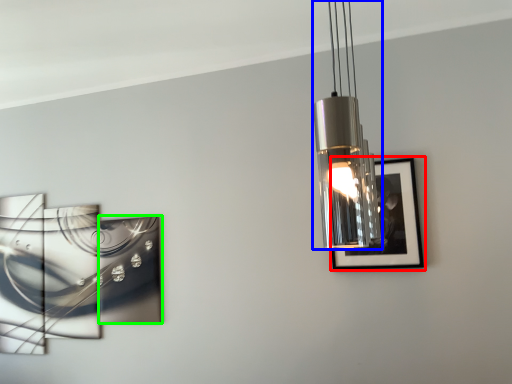
Question: Considering the real-world distances, which object is farthest from picture frame (highlighted by a red box)? lamp (highlighted by a blue box) or picture frame (highlighted by a green box)?

Choices:
 (A) lamp
 (B) picture frame

Answer: (B)